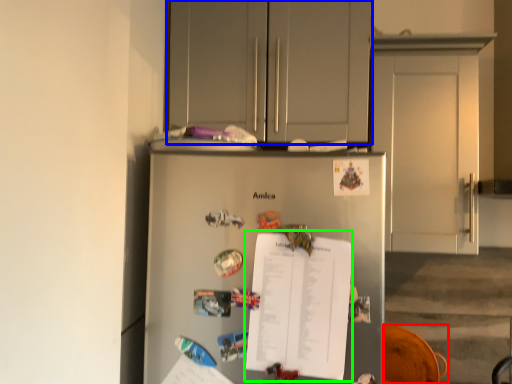
Question: Based on their relative distances, which object is farther from swivel chair (highlighted by a red box)? Choose from cabinetry (highlighted by a blue box) and journal (highlighted by a green box).

Choices:
 (A) cabinetry
 (B) journal

Answer: (A)